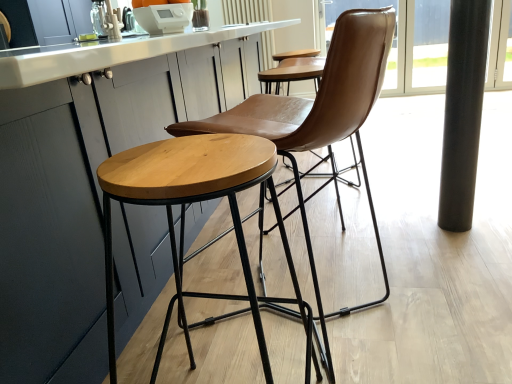
Where is `free space in front of black polished pole at right`? This screenshot has width=512, height=384. free space in front of black polished pole at right is located at coordinates (470, 239).